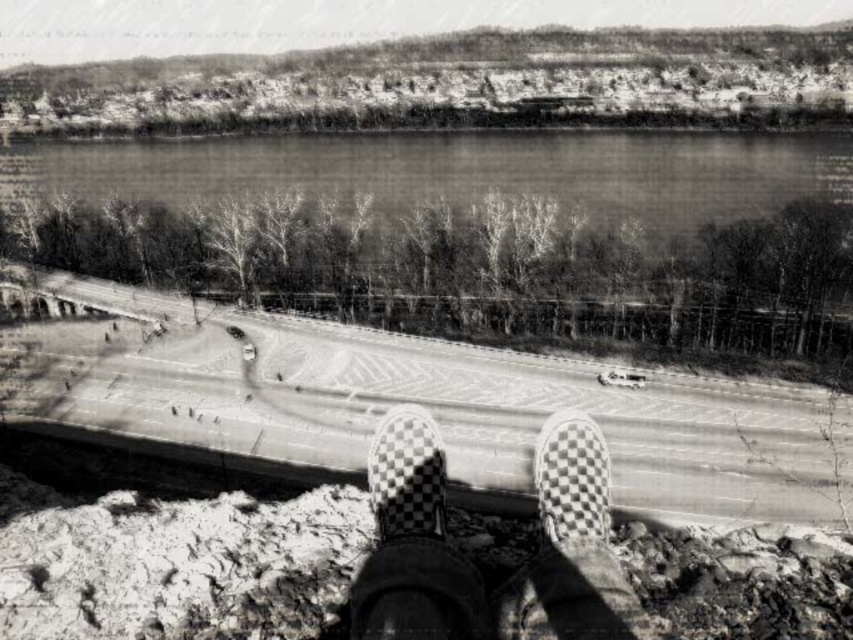
Which is in front, point (596, 460) or point (415, 520)?

Point (415, 520)

In the scene shown: Who is shorter, checkerboard-patterned shoes at center or checkerboard-patterned sneakers at center?

With less height is checkerboard-patterned sneakers at center.

Is point (550, 417) less distant than point (407, 422)?

No, it is behind (407, 422).

The height and width of the screenshot is (640, 853). Find the location of `checkerboard-patterned shoes at center`. checkerboard-patterned shoes at center is located at coordinates (471, 564).

Can you confirm if smooth water at upper center is wider than checkerboard-patterned sneakers at center?

Correct, the width of smooth water at upper center exceeds that of checkerboard-patterned sneakers at center.

Based on the photo, can you confirm if smooth water at upper center is positioned below checkerboard-patterned sneakers at center?

Actually, smooth water at upper center is above checkerboard-patterned sneakers at center.

In order to click on smooth water at upper center in this screenshot , I will do pyautogui.click(x=462, y=172).

Who is higher up, smooth water at upper center or checkerboard-patterned shoes at center?

smooth water at upper center is higher up.

Is smooth water at upper center to the left of checkerboard-patterned shoes at center from the viewer's perspective?

Yes, smooth water at upper center is to the left of checkerboard-patterned shoes at center.

Is point (347, 160) more distant than point (618, 570)?

Yes.

Find the location of a particular element. The height and width of the screenshot is (640, 853). smooth water at upper center is located at coordinates (x=462, y=172).